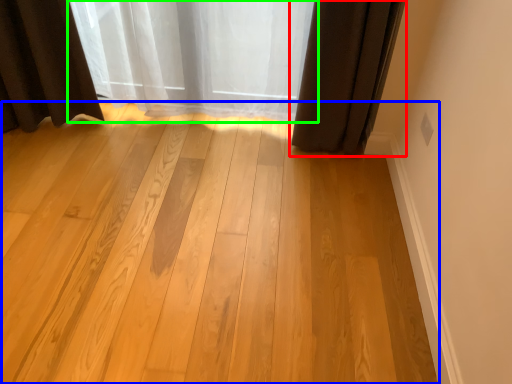
Question: Based on their relative distances, which object is farther from curtain (highlighted by a red box)? Choose from plank (highlighted by a blue box) and curtain (highlighted by a green box).

Choices:
 (A) plank
 (B) curtain

Answer: (A)